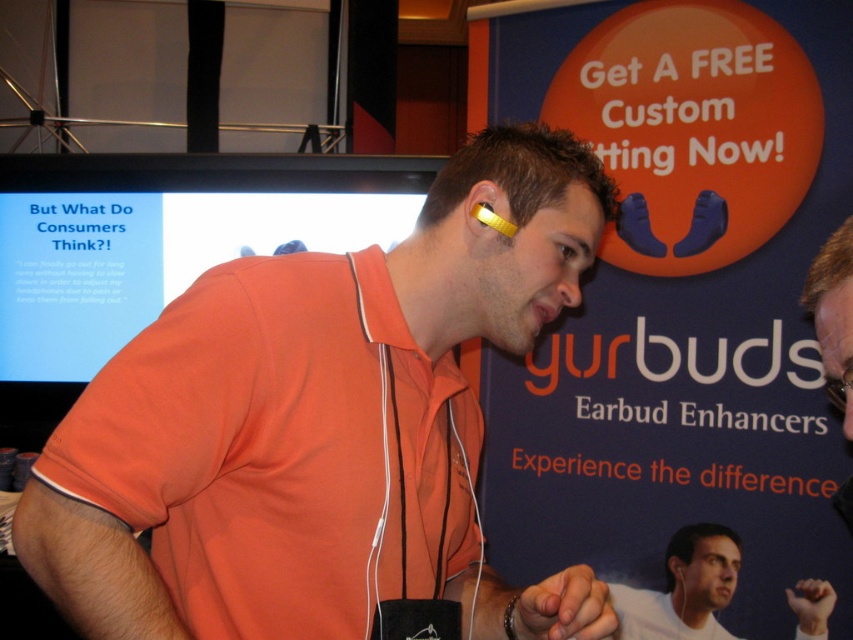
What are the coordinates of the matte black screen at upper left?

The coordinates of the matte black screen at upper left are (155, 248).